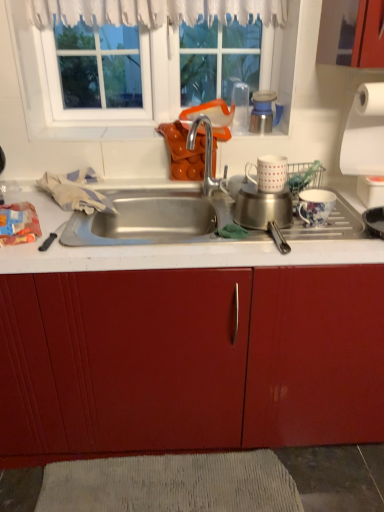
Locate an element on the screen. The image size is (384, 512). vacant area on top of white textured mat at lower center (from a real-world perspective) is located at coordinates (174, 472).